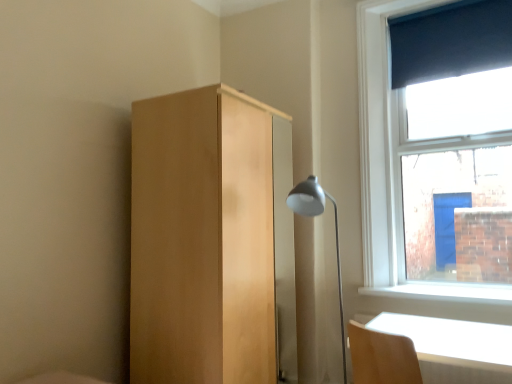
Question: Is matte silver lamp at center-right thinner than light wood table at lower right?

Choices:
 (A) yes
 (B) no

Answer: (A)

Question: Is light wood table at lower right inside matte silver lamp at center-right?

Choices:
 (A) yes
 (B) no

Answer: (B)

Question: From a real-world perspective, is matte silver lamp at center-right beneath light wood table at lower right?

Choices:
 (A) no
 (B) yes

Answer: (A)

Question: Can you confirm if matte silver lamp at center-right is taller than light wood table at lower right?

Choices:
 (A) no
 (B) yes

Answer: (B)

Question: From the image's perspective, would you say matte silver lamp at center-right is positioned over light wood table at lower right?

Choices:
 (A) no
 (B) yes

Answer: (B)

Question: Is matte silver lamp at center-right at the right side of light wood table at lower right?

Choices:
 (A) yes
 (B) no

Answer: (B)

Question: From a real-world perspective, is light wood dresser at center located beneath dark blue fabric at upper right?

Choices:
 (A) no
 (B) yes

Answer: (B)

Question: From a real-world perspective, is light wood dresser at center on top of dark blue fabric at upper right?

Choices:
 (A) yes
 (B) no

Answer: (B)

Question: From the image's perspective, is light wood dresser at center on dark blue fabric at upper right?

Choices:
 (A) yes
 (B) no

Answer: (B)

Question: Is dark blue fabric at upper right completely or partially inside light wood dresser at center?

Choices:
 (A) no
 (B) yes

Answer: (A)

Question: From the image's perspective, does light wood dresser at center appear lower than dark blue fabric at upper right?

Choices:
 (A) no
 (B) yes

Answer: (B)

Question: Would you say light wood dresser at center is a long distance from dark blue fabric at upper right?

Choices:
 (A) yes
 (B) no

Answer: (A)

Question: From the image's perspective, does light wood table at lower right appear lower than dark blue fabric at upper right?

Choices:
 (A) yes
 (B) no

Answer: (A)